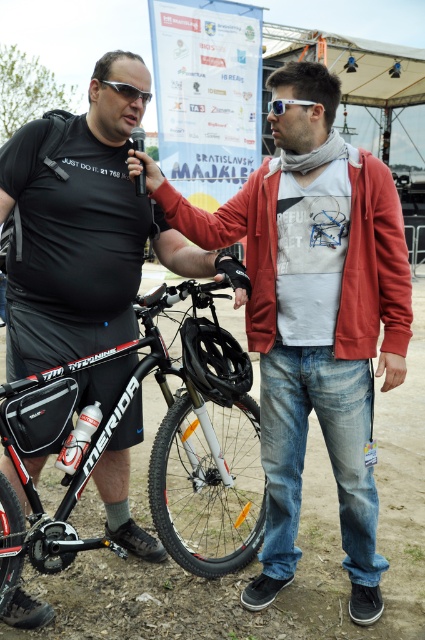
Question: Which of these objects is positioned farthest from the matte black jacket at center?

Choices:
 (A) black matte helmet at center
 (B) matte black sunglasses at upper left

Answer: (B)

Question: Is black matte helmet at center wider than matte black sunglasses at upper left?

Choices:
 (A) yes
 (B) no

Answer: (A)

Question: Where is black matte bicycle at center located in relation to matte black sunglasses at upper left in the image?

Choices:
 (A) above
 (B) below

Answer: (B)

Question: Based on their relative distances, which object is nearer to the matte black jacket at center?

Choices:
 (A) black matte helmet at center
 (B) transparent plastic goggles at upper center

Answer: (A)

Question: Which object is positioned closest to the matte black sunglasses at upper left?

Choices:
 (A) matte black jacket at center
 (B) black matte helmet at center
 (C) black matte bicycle at center

Answer: (B)

Question: Is black matte bicycle at center bigger than transparent plastic goggles at upper center?

Choices:
 (A) no
 (B) yes

Answer: (A)